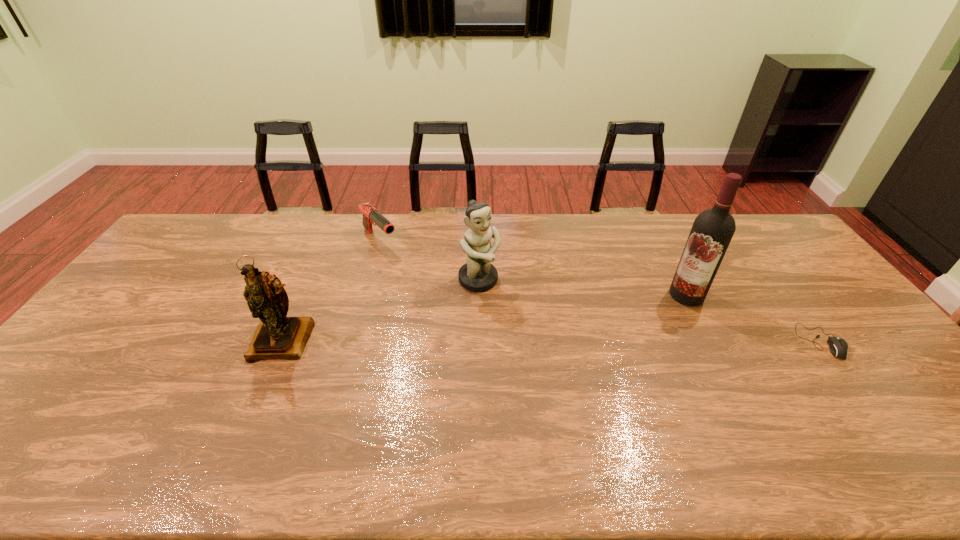
The image size is (960, 540). In order to click on vacant space on the desktop that is between the leftmost object and the shortest object and is positioned on the front-facing side of the third object from left to right in this screenshot , I will do `click(534, 341)`.

Identify the location of free spot on the desktop that is between the leftmost object and the computer mouse and is positioned on the label of the wine bottle. (598, 341).

Where is `free spot on the desktop that is between the left figurine and the shortest object and is positioned at the aiming end of the fourth tallest object`? This screenshot has height=540, width=960. free spot on the desktop that is between the left figurine and the shortest object and is positioned at the aiming end of the fourth tallest object is located at coordinates (485, 341).